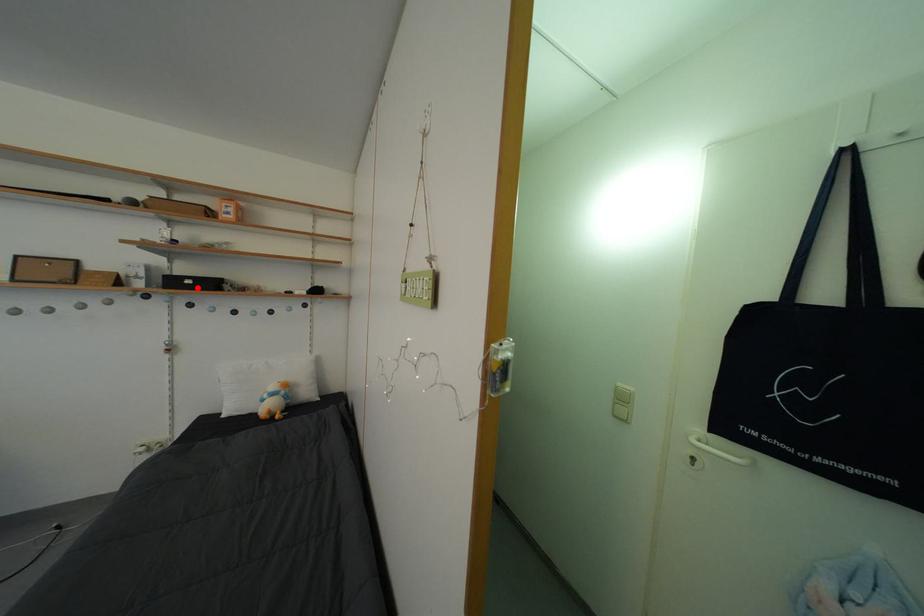
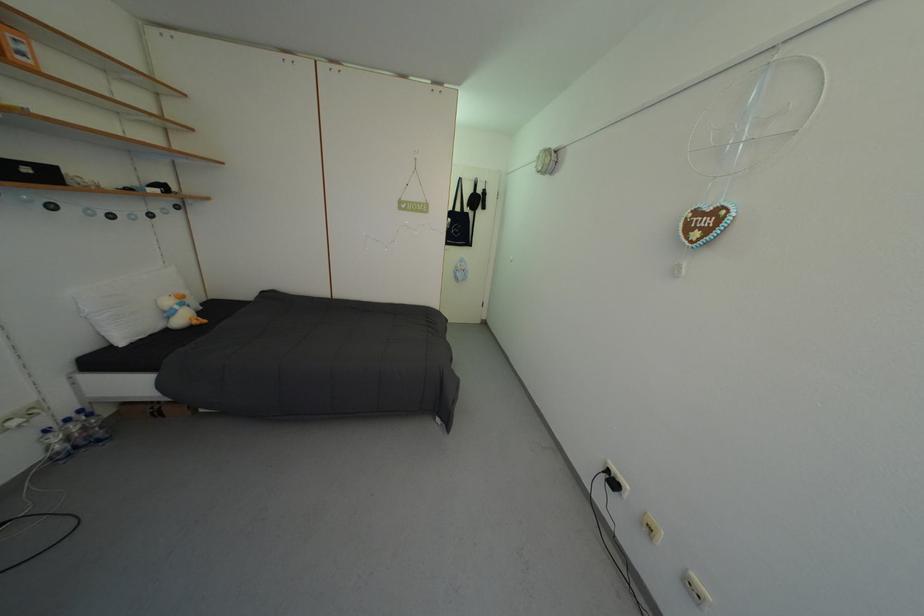
In the second image, find the point that corresponds to the highlighted location in the first image.

(35, 176)